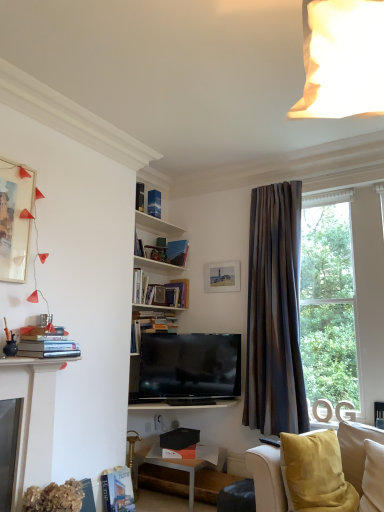
Find the location of a particular element. The width and height of the screenshot is (384, 512). blue paper book at upper center, acting as the 3th book starting from the back is located at coordinates (154, 203).

How much space does matte silver picture frame at upper center, arranged as the first picture frame when ordered from the bottom, occupy horizontally?

2.32 inches.

How much space does matte white picture frame at upper left, acting as the 1th picture frame starting from the front, occupy horizontally?

matte white picture frame at upper left, acting as the 1th picture frame starting from the front, is 3.25 inches in width.

How much space does matte white picture frame at upper left, acting as the 1th picture frame starting from the front, occupy vertically?

matte white picture frame at upper left, acting as the 1th picture frame starting from the front, is 30.62 inches tall.

Find the location of a particular element. satin black tv at center is located at coordinates (190, 366).

This screenshot has width=384, height=512. I want to click on blue paper book at upper center, which appears as the 5th book when ordered from the bottom, so click(x=154, y=203).

Is matte white picture frame at upper left, which is the second picture frame in bottom-to-top order, outside of satin black tv at center?

Indeed, matte white picture frame at upper left, which is the second picture frame in bottom-to-top order, is completely outside satin black tv at center.

From the image's perspective, which is above, matte white picture frame at upper left, which is the second picture frame in bottom-to-top order, or satin black tv at center?

matte white picture frame at upper left, which is the second picture frame in bottom-to-top order.

Which of these two, matte white picture frame at upper left, which ranks as the 1th picture frame in left-to-right order, or satin black tv at center, is bigger?

satin black tv at center.

Between matte white picture frame at upper left, acting as the second picture frame starting from the back, and satin black tv at center, which one has less height?

satin black tv at center.

From the image's perspective, which object appears higher, dark gray textured curtain at right or wooden books at upper center, the 1th shelf when ordered from bottom to top?

wooden books at upper center, the 1th shelf when ordered from bottom to top, is shown above in the image.

How different are the orientations of dark gray textured curtain at right and wooden books at upper center, the second shelf in the top-to-bottom sequence, in degrees?

The angle between the facing direction of dark gray textured curtain at right and the facing direction of wooden books at upper center, the second shelf in the top-to-bottom sequence, is 97 degrees.

Between point (281, 297) and point (146, 262), which one is positioned in front?

The point (281, 297) is more forward.

Is dark gray textured curtain at right turned away from wooden books at upper center, the second shelf in the top-to-bottom sequence?

dark gray textured curtain at right is not turned away from wooden books at upper center, the second shelf in the top-to-bottom sequence.

Are matte white picture frame at upper left, which is the second picture frame in bottom-to-top order, and hardcover book at center, which is the 3th book in bottom-to-top order, far apart?

matte white picture frame at upper left, which is the second picture frame in bottom-to-top order, is positioned a significant distance from hardcover book at center, which is the 3th book in bottom-to-top order.

From the image's perspective, does matte white picture frame at upper left, acting as the second picture frame starting from the back, appear lower than hardcover book at center, arranged as the 2th book when viewed from the back?

No, from the image's perspective, matte white picture frame at upper left, acting as the second picture frame starting from the back, is not beneath hardcover book at center, arranged as the 2th book when viewed from the back.

Is point (3, 192) closer to viewer compared to point (183, 280)?

Yes.

From the picture: Is matte white picture frame at upper left, which ranks as the 1th picture frame in left-to-right order, closer to camera compared to hardcover book at center, which is the 3th book in bottom-to-top order?

Yes.

From a real-world perspective, is white wooden shelves at upper center, which is the first shelf in top-to-bottom order, positioned above or below satin black tv at center?

white wooden shelves at upper center, which is the first shelf in top-to-bottom order, is situated higher than satin black tv at center in the real world.

Who is taller, white wooden shelves at upper center, the second shelf positioned from the bottom, or satin black tv at center?

With more height is satin black tv at center.

In order to click on the 2nd shelf to the left of the satin black tv at center, counting from the anchor's position in this screenshot , I will do `click(156, 225)`.

Considering the relative sizes of white wooden shelves at upper center, which is the first shelf in top-to-bottom order, and satin black tv at center in the image provided, is white wooden shelves at upper center, which is the first shelf in top-to-bottom order, bigger than satin black tv at center?

No.

Considering the relative sizes of dark gray textured curtain at right and hardcover book at center, the fifth book positioned from the front, in the image provided, is dark gray textured curtain at right bigger than hardcover book at center, the fifth book positioned from the front,?

Indeed, dark gray textured curtain at right has a larger size compared to hardcover book at center, the fifth book positioned from the front.

How much distance is there between dark gray textured curtain at right and hardcover book at center, arranged as the 2th book when viewed from the back?

The distance of dark gray textured curtain at right from hardcover book at center, arranged as the 2th book when viewed from the back, is 3.64 feet.

From the image's perspective, is dark gray textured curtain at right over hardcover book at center, positioned as the 4th book in top-to-bottom order?

No, from the image's perspective, dark gray textured curtain at right is not on top of hardcover book at center, positioned as the 4th book in top-to-bottom order.

Does point (284, 381) lie behind point (175, 285)?

No, it is in front of (175, 285).

Which is further, (171,269) or (182,390)?

The point (171,269) is behind.

Is wooden books at upper center, the 1th shelf when ordered from bottom to top, oriented towards satin black tv at center?

No, wooden books at upper center, the 1th shelf when ordered from bottom to top, is not facing towards satin black tv at center.

Which of these two, wooden books at upper center, the 1th shelf when ordered from bottom to top, or satin black tv at center, is wider?

Wider between the two is wooden books at upper center, the 1th shelf when ordered from bottom to top.

Who is more distant, wooden books at upper center, the second shelf in the top-to-bottom sequence, or satin black tv at center?

wooden books at upper center, the second shelf in the top-to-bottom sequence, is further away from the camera.

Is point (142, 193) closer or farther from the camera than point (258, 479)?

Point (142, 193).

From the image's perspective, is hardcover book at upper center, placed as the fourth book when sorted from back to front, beneath velvet yellow couch at lower right?

No.

Can you confirm if hardcover book at upper center, which ranks as the first book in top-to-bottom order, is taller than velvet yellow couch at lower right?

No, hardcover book at upper center, which ranks as the first book in top-to-bottom order, is not taller than velvet yellow couch at lower right.

Is hardcover book at upper center, the third book viewed from the front, oriented away from velvet yellow couch at lower right?

No, velvet yellow couch at lower right is not at the back of hardcover book at upper center, the third book viewed from the front.

The width and height of the screenshot is (384, 512). Identify the location of the 2nd picture frame above the satin black tv at center (from a real-world perspective). point(15,220).

From the image's perspective, starting from the dark gray textured curtain at right, which shelf is the 1st one above? Please provide its 2D coordinates.

[(158, 266)]

Considering their positions, is hardcover book at upper center, which ranks as the first book in top-to-bottom order, positioned further to white wooden shelves at upper center, which is the first shelf in top-to-bottom order, than hardcover book at center, which is the 3th book in bottom-to-top order?

Among the two, hardcover book at center, which is the 3th book in bottom-to-top order, is located further to white wooden shelves at upper center, which is the first shelf in top-to-bottom order.

Based on their spatial positions, is transparent glass window at upper right or hardcover book at center, positioned as the 4th book in top-to-bottom order, closer to hardcover book at upper center, the third book viewed from the front?

hardcover book at center, positioned as the 4th book in top-to-bottom order, is closer to hardcover book at upper center, the third book viewed from the front.

Which object lies nearer to the anchor point wooden books at upper center, the 1th shelf when ordered from bottom to top, hardcover book at lower left, the 1th book positioned from the bottom, or hardcover books at left, which is the sixth book from back to front?

hardcover books at left, which is the sixth book from back to front.

Estimate the real-world distances between objects in this image. Which object is further from velvet yellow couch at lower right, matte silver picture frame at upper center, which is the first picture frame in right-to-left order, or matte white picture frame at upper left, acting as the 1th picture frame starting from the front?

Among the two, matte white picture frame at upper left, acting as the 1th picture frame starting from the front, is located further to velvet yellow couch at lower right.

Looking at the image, which one is located closer to wooden books at upper center, the 1th shelf when ordered from bottom to top, hardcover book at upper center, placed as the fourth book when sorted from back to front, or hardcover books at left, the 1th book viewed from the front?

hardcover book at upper center, placed as the fourth book when sorted from back to front, lies closer to wooden books at upper center, the 1th shelf when ordered from bottom to top, than the other object.

From the image, which object appears to be nearer to transparent glass window at upper right, hardcover book at center, the fifth book positioned from the front, or blue paper book at upper center, acting as the 3th book starting from the back?

hardcover book at center, the fifth book positioned from the front, is positioned closer to the anchor transparent glass window at upper right.

Which object lies further to the anchor point hardcover book at center, which is the 3th book in bottom-to-top order, matte white picture frame at upper left, acting as the 1th picture frame starting from the front, or velvet yellow couch at lower right?

Based on the image, velvet yellow couch at lower right appears to be further to hardcover book at center, which is the 3th book in bottom-to-top order.

Which object lies further to the anchor point satin black tv at center, white glossy table at lower center or blue paper book at upper center, which appears as the 5th book when ordered from the bottom?

blue paper book at upper center, which appears as the 5th book when ordered from the bottom, lies further to satin black tv at center than the other object.

You are a GUI agent. You are given a task and a screenshot of the screen. Output one action in this format:
    pyautogui.click(x=<x>, y=<y>)
    Task: Click on the picture frame located between hardcover book at lower left, the sixth book from the top, and transparent glass window at upper right in the left-right direction
    
    Given the screenshot: What is the action you would take?
    pyautogui.click(x=222, y=277)

Where is `television between blue paper book at upper center, the 2th book viewed from the top, and white glossy table at lower center vertically`? This screenshot has width=384, height=512. television between blue paper book at upper center, the 2th book viewed from the top, and white glossy table at lower center vertically is located at coordinates point(190,366).

You are a GUI agent. You are given a task and a screenshot of the screen. Output one action in this format:
    pyautogui.click(x=<x>, y=<y>)
    Task: Click on the picture frame situated between satin black tv at center and transparent glass window at upper right from left to right
    The width and height of the screenshot is (384, 512).
    Given the screenshot: What is the action you would take?
    pyautogui.click(x=222, y=277)

Identify the location of curtain between matte silver picture frame at upper center, arranged as the first picture frame when ordered from the bottom, and white glossy table at lower center in the up-down direction. (274, 313).